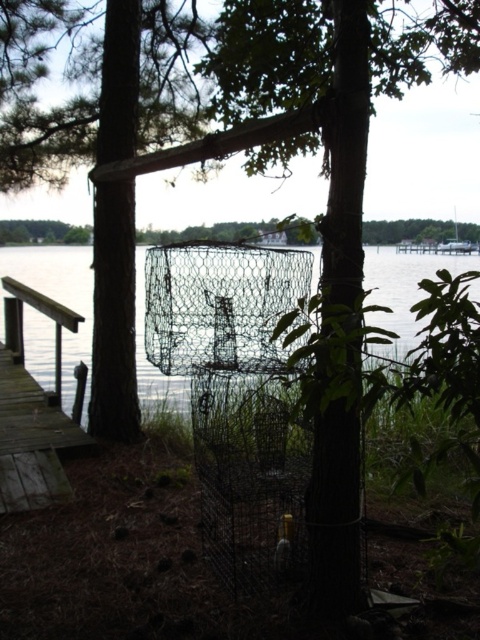
Question: Based on their relative distances, which object is farther from the wooden dock at left?

Choices:
 (A) metallic wire basket at center
 (B) wire mesh net at center

Answer: (A)

Question: Which point is farther from the camera taking this photo?

Choices:
 (A) (460, 268)
 (B) (262, 337)
 (C) (33, 417)

Answer: (A)

Question: Can you confirm if wire mesh net at center is positioned to the left of wooden dock at left?

Choices:
 (A) yes
 (B) no

Answer: (B)

Question: Which object appears closest to the camera in this image?

Choices:
 (A) wire mesh net at center
 (B) metallic wire basket at center

Answer: (A)

Question: Does wire mesh net at center have a larger size compared to wooden dock at left?

Choices:
 (A) yes
 (B) no

Answer: (B)

Question: Does wire mesh net at center have a lesser width compared to wooden dock at left?

Choices:
 (A) no
 (B) yes

Answer: (B)